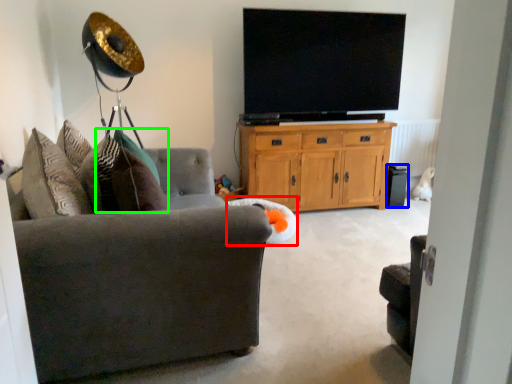
Question: Which object is the farthest from bean bag chair (highlighted by a red box)? Choose among these: speaker (highlighted by a blue box) or pillow (highlighted by a green box).

Choices:
 (A) speaker
 (B) pillow

Answer: (A)